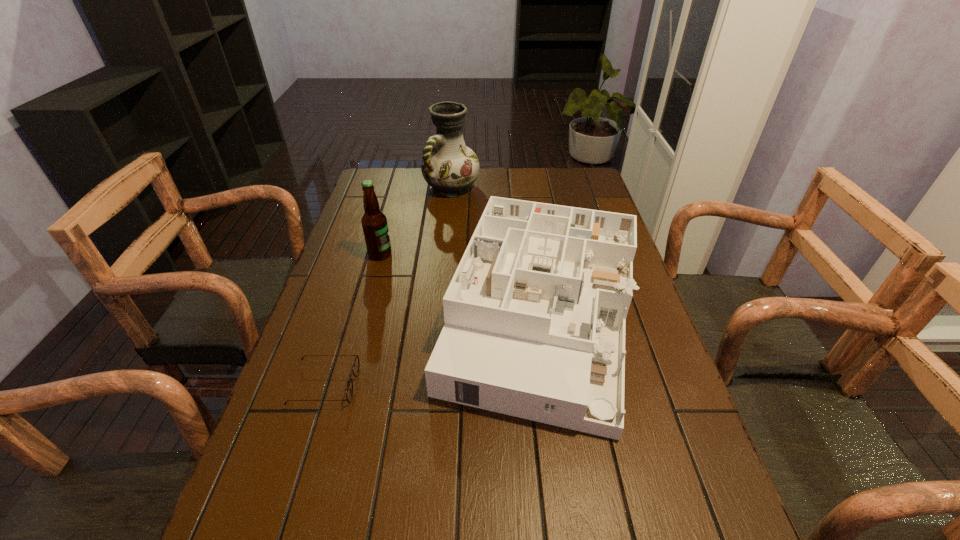
At what (x,y) coordinates should I click in order to perform the action: click on the closest object to the third tallest object. Please return your answer as a coordinate pair (x, y). The image size is (960, 540). Looking at the image, I should click on pyautogui.click(x=374, y=222).

You are a GUI agent. You are given a task and a screenshot of the screen. Output one action in this format:
    pyautogui.click(x=<x>, y=<y>)
    Task: Click on the second closest object to the third shortest object
    
    Given the screenshot: What is the action you would take?
    pyautogui.click(x=450, y=167)

At what (x,y) coordinates should I click in order to perform the action: click on free space that satisfies the following two spatial constraints: 1. on the label of the beer bottle; 2. on the right side of the dollhouse. Please return your answer as a coordinate pair (x, y). Looking at the image, I should click on (362, 320).

The height and width of the screenshot is (540, 960). Identify the location of free spot that satisfies the following two spatial constraints: 1. on the label of the third tallest object; 2. on the right side of the third shortest object. (362, 320).

Identify the location of free space that satisfies the following two spatial constraints: 1. on the label of the dollhouse; 2. on the left side of the third shortest object. Image resolution: width=960 pixels, height=540 pixels. (362, 320).

You are a GUI agent. You are given a task and a screenshot of the screen. Output one action in this format:
    pyautogui.click(x=<x>, y=<y>)
    Task: Click on the vacant area in the image that satisfies the following two spatial constraints: 1. on the label of the beer bottle; 2. on the right side of the dollhouse
    
    Given the screenshot: What is the action you would take?
    pyautogui.click(x=362, y=320)

Identify the location of vacant area in the image that satisfies the following two spatial constraints: 1. on the label of the beer bottle; 2. on the left side of the dollhouse. This screenshot has height=540, width=960. (362, 320).

This screenshot has height=540, width=960. What are the coordinates of `free point that satisfies the following two spatial constraints: 1. on the front side of the dollhouse; 2. on the front-facing side of the shortest object` in the screenshot? It's located at (550, 385).